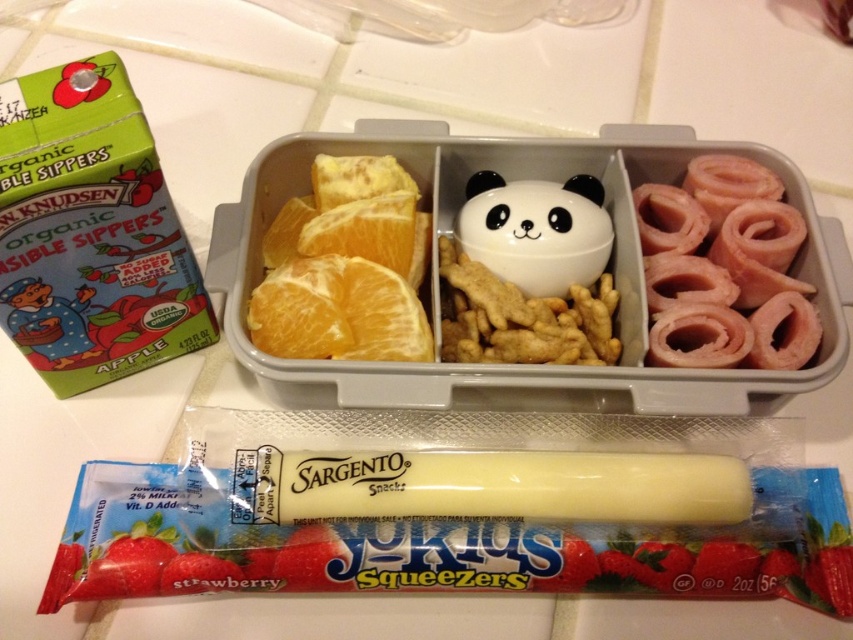
You are preparing to pack a lunchbox and have the green matte apple juice box at upper left and the yellow matte orange at upper left. Which one takes up more space in your lunchbox?

The green matte apple juice box at upper left is bigger than the yellow matte orange at upper left, so it takes up more space in the lunchbox.

Looking at this image, you are preparing to pack a lunchbox and have both the orangejuicy fleshfruit at left and the yellow matte orange at upper left in front of you. Which one should you choose if you want the fruit that takes up more space in your container?

The orangejuicy fleshfruit at left is larger in size compared to the yellow matte orange at upper left, so it will take up more space in your container.

You are a drone operator trying to deliver a small package to either point A at coordinate point (55,371) or point B at coordinate point (480,208). Which point is closer to you?

Point point (55,371) is closer to the viewer than point point (480,208), so you should deliver the package to point A at coordinate point (55,371).